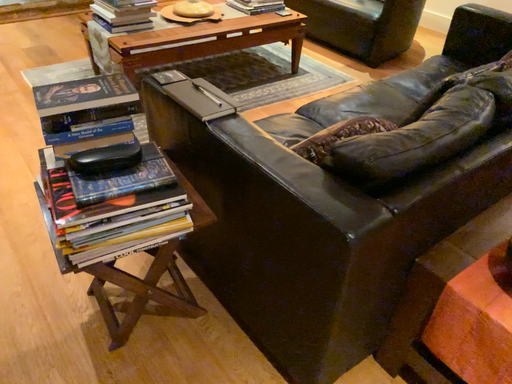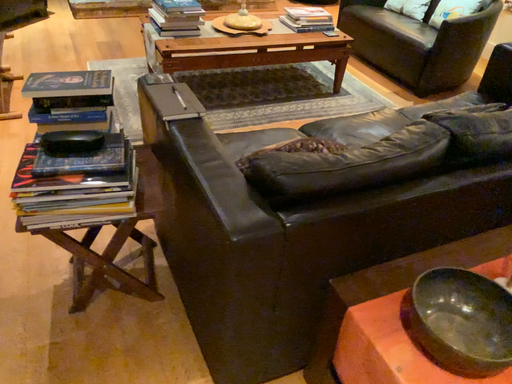
Question: Which way did the camera rotate in the video?

Choices:
 (A) rotated right
 (B) rotated left

Answer: (B)